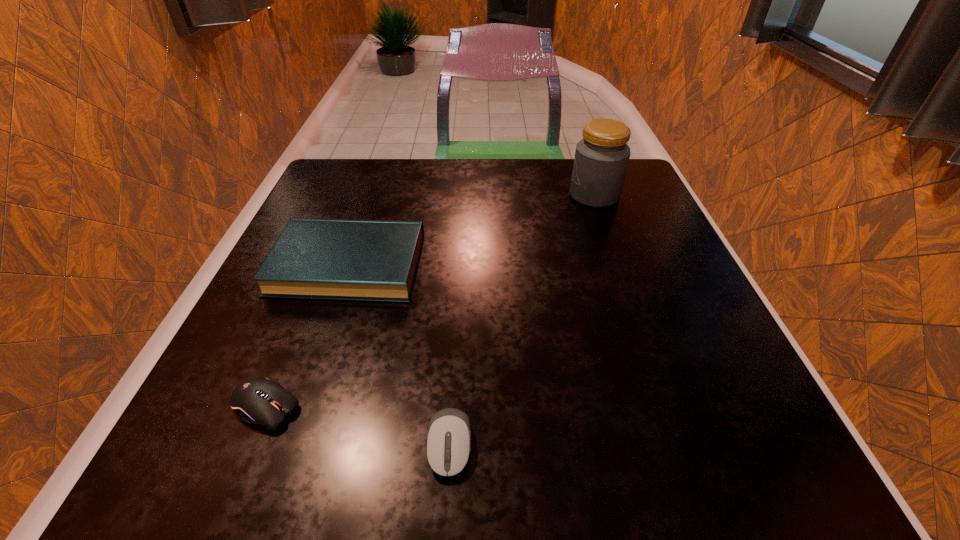
In the image, there is a desktop. Where is `blank space at the far left corner`? blank space at the far left corner is located at coordinates (377, 179).

Where is `vacant region at the near left corner of the desktop`? This screenshot has width=960, height=540. vacant region at the near left corner of the desktop is located at coordinates (212, 480).

In the image, there is a desktop. Where is `vacant space at the near right corner`? vacant space at the near right corner is located at coordinates (732, 431).

The width and height of the screenshot is (960, 540). Find the location of `free space between the second object from right to left and the second farthest object`. free space between the second object from right to left and the second farthest object is located at coordinates (399, 355).

This screenshot has height=540, width=960. Identify the location of vacant space that is in between the second object from right to left and the farthest object. (522, 320).

At what (x,y) coordinates should I click in order to perform the action: click on free area in between the book and the right computer equipment. Please return your answer as a coordinate pair (x, y). This screenshot has width=960, height=540. Looking at the image, I should click on (399, 355).

Locate an element on the screen. vacant point located between the farthest object and the right computer equipment is located at coordinates (522, 320).

Identify the location of free area in between the left computer equipment and the jar. Image resolution: width=960 pixels, height=540 pixels. (430, 301).

You are a GUI agent. You are given a task and a screenshot of the screen. Output one action in this format:
    pyautogui.click(x=<x>, y=<y>)
    Task: Click on the vacant space that's between the left computer equipment and the farthest object
    This screenshot has height=540, width=960.
    Given the screenshot: What is the action you would take?
    pyautogui.click(x=430, y=301)

The width and height of the screenshot is (960, 540). I want to click on free space between the left computer equipment and the tallest object, so click(x=430, y=301).